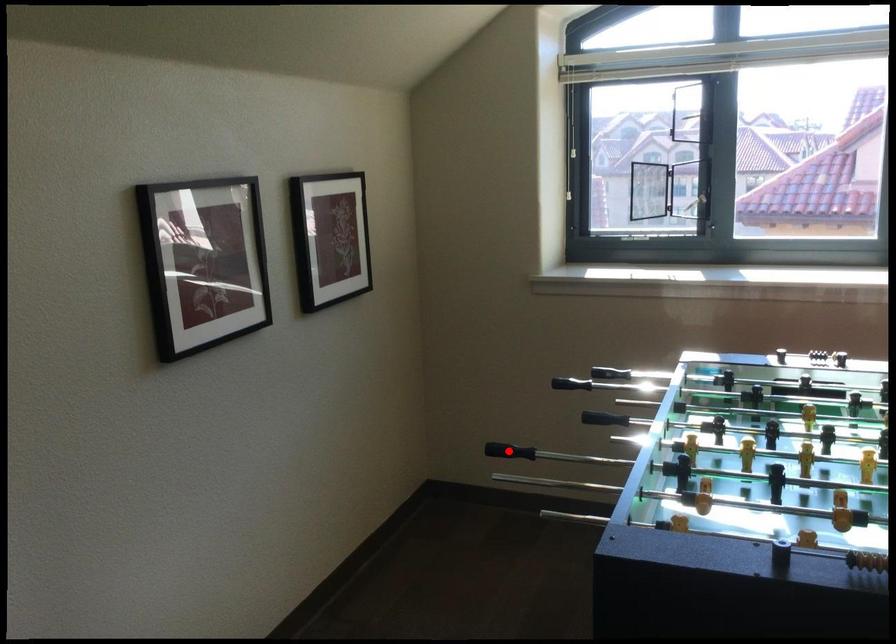
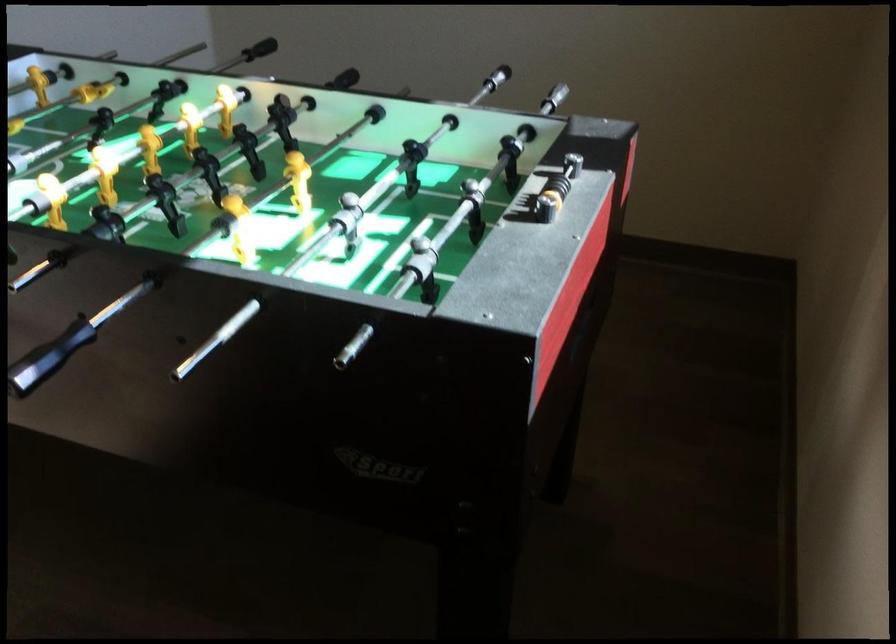
Question: I am providing you with two images of the same scene from different viewpoints. A red point is marked on the first image. Is the red point's position out of view in image 2?

Choices:
 (A) Yes
 (B) No

Answer: (A)